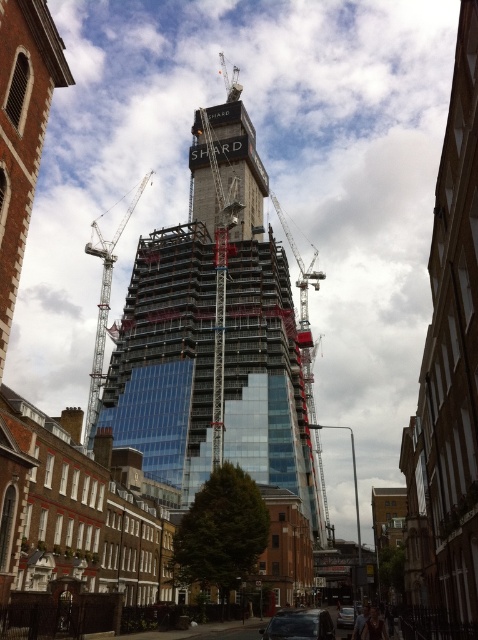
From the picture: You are a pedestrian standing on the street and see the glassy steel tower at center and the metallic silver car at lower center. Which object is closer to you?

The metallic silver car at lower center is closer to you because it is positioned below the glassy steel tower at center, indicating it is nearer in the scene.

You are a city planner reviewing the urban layout. Given the coordinates provided, can you confirm the exact location of the glassy steel tower at center relative to the other structures in the scene?

The glassy steel tower at center is located at coordinates point (216, 333), which places it centrally within the scene as described.

You are a photographer standing in the middle of the street in front of the Shard building. You want to take a photo that includes both the point at coordinates point (x=170, y=435) and point (x=321, y=449). Which point should you focus on first to ensure both are in focus?

You should focus on point (x=170, y=435) first because it is closer to the camera than point (x=321, y=449), ensuring both points are within the depth of field.